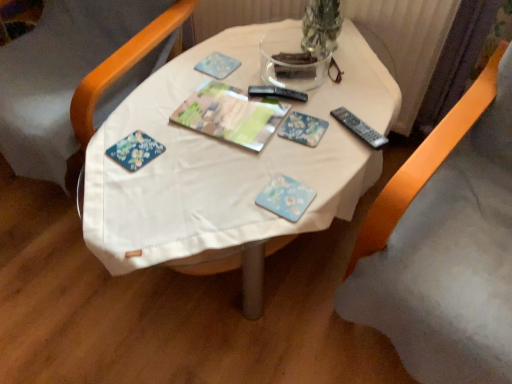
Image resolution: width=512 pixels, height=384 pixels. Identify the location of vacant space in between black plastic remote at right and floral-patterned paper at center-left. (249, 150).